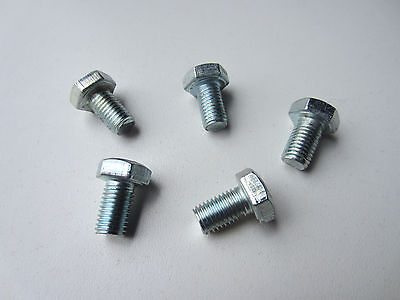
Find the location of `counter`. counter is located at coordinates (318, 229).